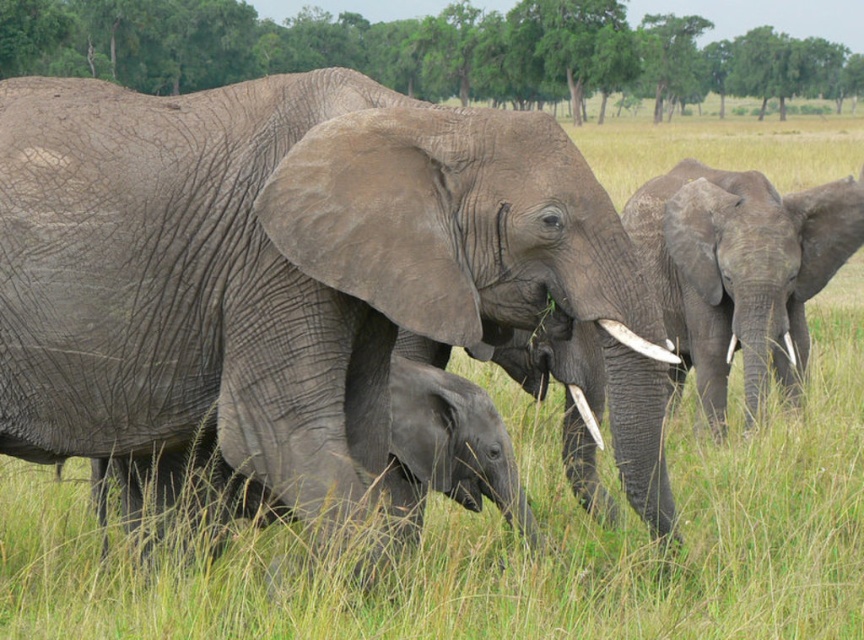
Question: Is gray matte/skin-like baby elephant at center below white glossy tusk at lower right?

Choices:
 (A) yes
 (B) no

Answer: (A)

Question: Among these points, which one is farthest from the camera?

Choices:
 (A) (137, 490)
 (B) (16, 440)
 (C) (753, 310)
 (D) (621, 326)

Answer: (C)

Question: Can you confirm if gray matte elephant at center is positioned above gray rough elephant at right?

Choices:
 (A) yes
 (B) no

Answer: (B)

Question: Based on their relative distances, which object is farther from the gray matte/skin-like baby elephant at center?

Choices:
 (A) gray matte elephant at center
 (B) gray rough elephant at right
 (C) white ivory tusk at center
 (D) white glossy tusk at lower right

Answer: (B)

Question: Which point is farther from the camera taking this photo?

Choices:
 (A) (35, 298)
 (B) (618, 323)
 (C) (726, 369)

Answer: (C)

Question: Can you confirm if white ivory tusk at center is smaller than white glossy tusk at lower right?

Choices:
 (A) no
 (B) yes

Answer: (B)